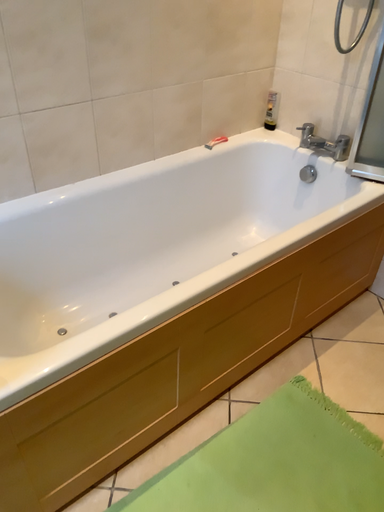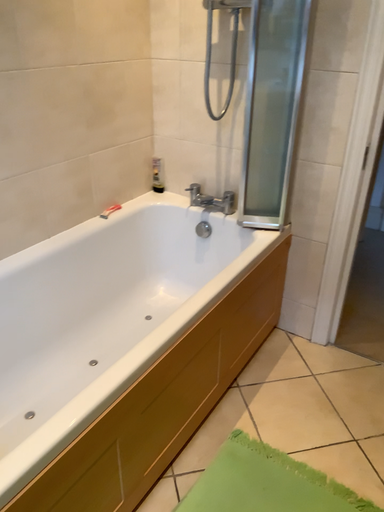
Question: How did the camera likely rotate when shooting the video?

Choices:
 (A) rotated downward
 (B) rotated upward

Answer: (B)